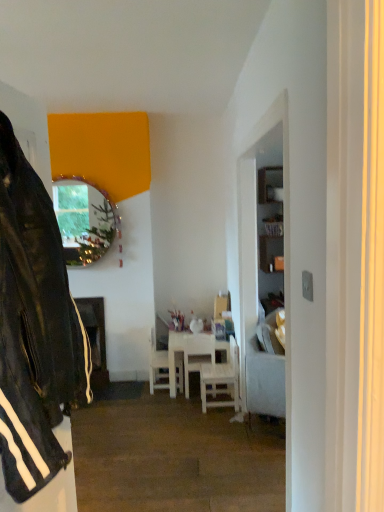
Question: Considering the positions of white wood chair at center, which is the 2th chair from left to right, and white wooden chair at center, which is the 1th chair from right to left, in the image, is white wood chair at center, which is the 2th chair from left to right, wider or thinner than white wooden chair at center, which is the 1th chair from right to left,?

Choices:
 (A) wide
 (B) thin

Answer: (B)

Question: Considering the positions of point (206, 353) and point (238, 406), is point (206, 353) closer or farther from the camera than point (238, 406)?

Choices:
 (A) farther
 (B) closer

Answer: (A)

Question: Estimate the real-world distances between objects in this image. Which object is closer to the light gray fabric couch at right?

Choices:
 (A) white wood chair at center, the 1th chair from the left
 (B) white wood chair at center, which is the 2th chair from left to right
 (C) white wooden table at center
 (D) metallic reflective mirror at upper left
 (E) black leather jacket at left

Answer: (C)

Question: Which object is the farthest from the metallic reflective mirror at upper left?

Choices:
 (A) white wood chair at center, the 2th chair when ordered from right to left
 (B) light gray fabric couch at right
 (C) black leather jacket at left
 (D) white wood chair at center, which is the 3th chair from right to left
 (E) white wooden chair at center, which ranks as the 3th chair in left-to-right order

Answer: (C)